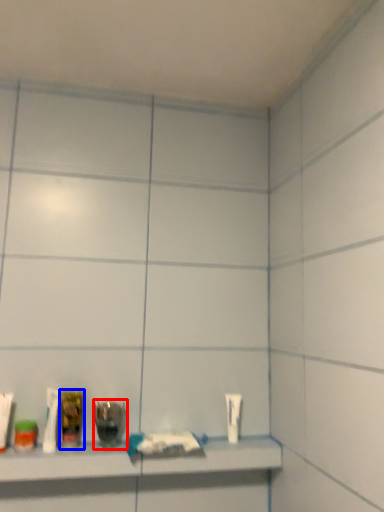
Question: Among these objects, which one is farthest to the camera, mouthwash (highlighted by a red box) or mouthwash (highlighted by a blue box)?

Choices:
 (A) mouthwash
 (B) mouthwash

Answer: (A)